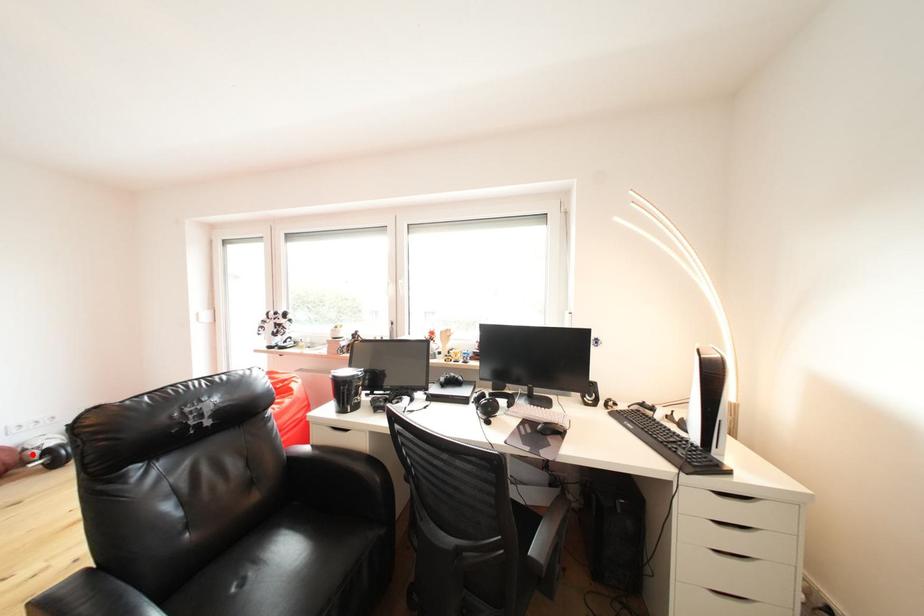
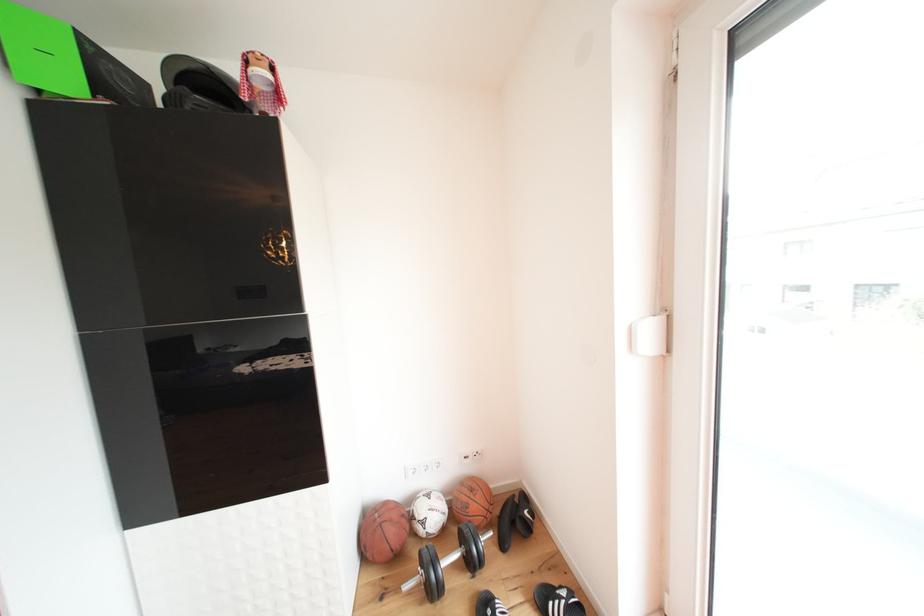
In the second image, find the point that corresponds to the highlighted location in the first image.

(420, 523)